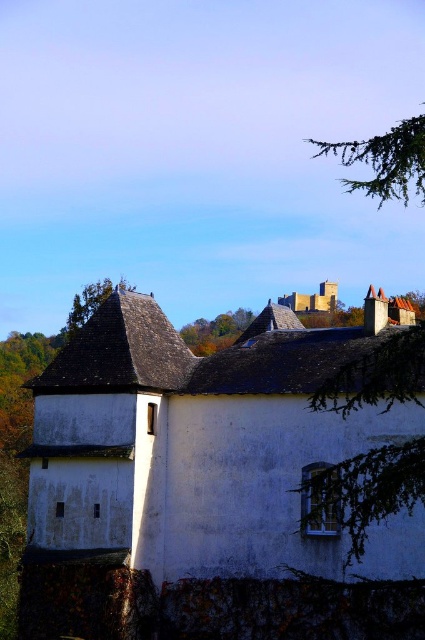
Question: From the image, what is the correct spatial relationship of white matte stone castle at center in relation to brown stone castle at upper center?

Choices:
 (A) left
 (B) right

Answer: (A)

Question: Based on their relative distances, which object is nearer to the brown stone castle at upper center?

Choices:
 (A) green needle-like leaves at upper right
 (B) green leafy tree at upper center
 (C) green shingled roof at upper center
 (D) white matte stone castle at center

Answer: (B)

Question: Does green needle-like leaves at upper right appear over green leafy tree at upper center?

Choices:
 (A) no
 (B) yes

Answer: (B)

Question: Which of the following is the closest to the observer?

Choices:
 (A) (82, 316)
 (B) (229, 333)
 (C) (232, 346)

Answer: (A)

Question: Which of the following is the farthest from the observer?

Choices:
 (A) green leafy tree at upper center
 (B) green needle-like leaves at upper right
 (C) white matte stone castle at center
 (D) brown stone castle at upper center

Answer: (D)

Question: Can you confirm if white matte stone castle at center is positioned to the left of green needle-like leaves at upper right?

Choices:
 (A) no
 (B) yes

Answer: (B)